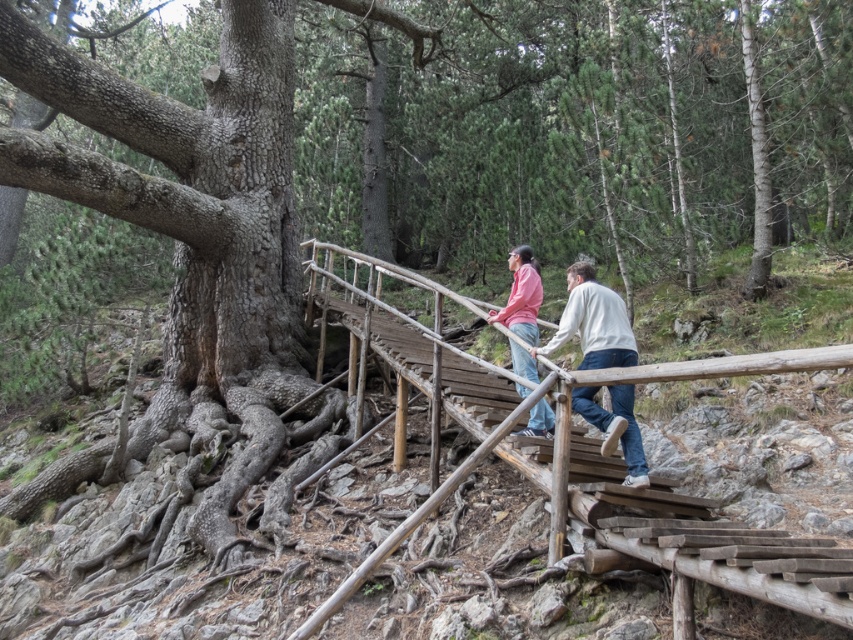
Question: Is wooden rail at center further to the viewer compared to matte pink sweater at center?

Choices:
 (A) no
 (B) yes

Answer: (A)

Question: Based on their relative distances, which object is nearer to the matte pink sweater at center?

Choices:
 (A) matte pink shirt at center
 (B) wooden rail at center

Answer: (B)

Question: Does matte pink sweater at center lie in front of matte pink shirt at center?

Choices:
 (A) yes
 (B) no

Answer: (A)

Question: Does wooden rail at center appear on the left side of matte pink shirt at center?

Choices:
 (A) no
 (B) yes

Answer: (A)

Question: Which object appears farthest from the camera in this image?

Choices:
 (A) wooden rail at center
 (B) matte pink shirt at center

Answer: (B)

Question: Among these points, which one is nearest to the camera?

Choices:
 (A) (496, 310)
 (B) (564, 426)

Answer: (B)